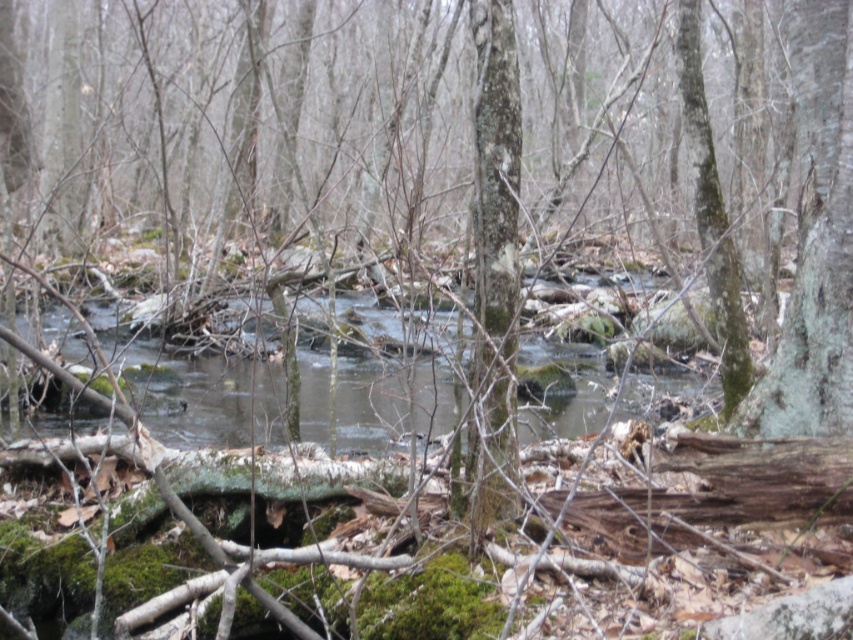
You are standing at the edge of the stream in the forest scene. You notice a point marked at coordinates (494,266). What object is located at that point?

The point at coordinates (494,266) indicates the green mossy bark tree trunk at center.